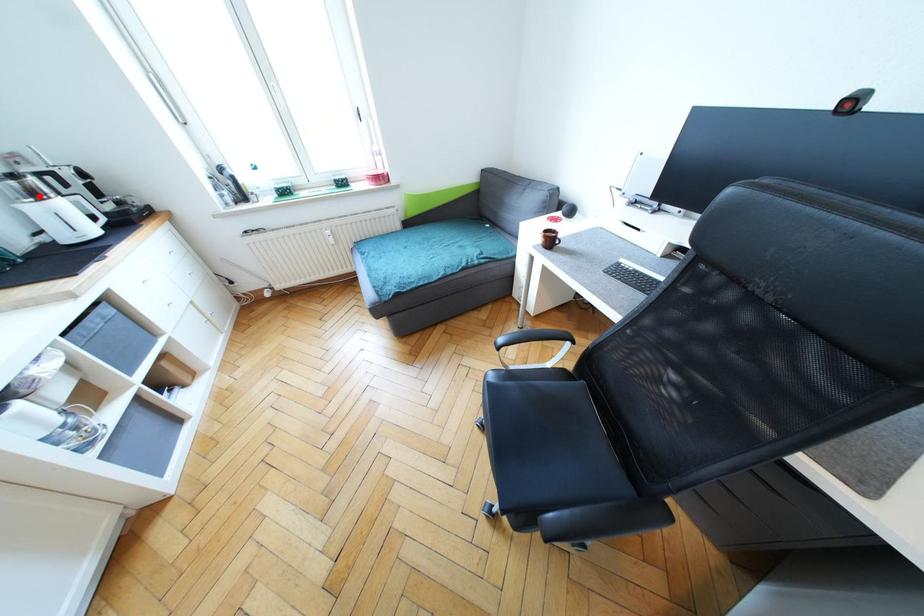
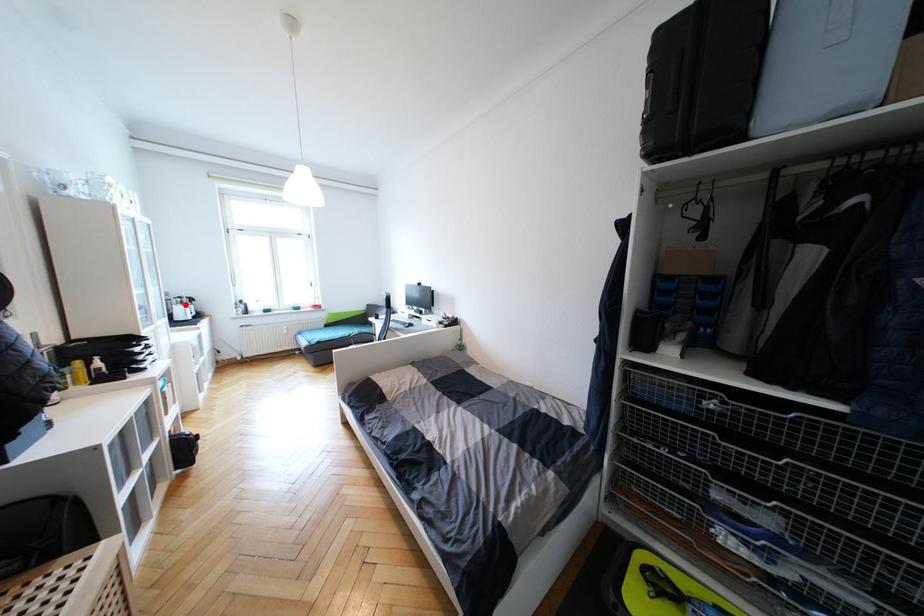
I am providing you with two images of the same scene from different viewpoints. A red point is marked on the first image and another point is marked on the second image. Do the highlighted points in image1 and image2 indicate the same real-world spot?

Yes